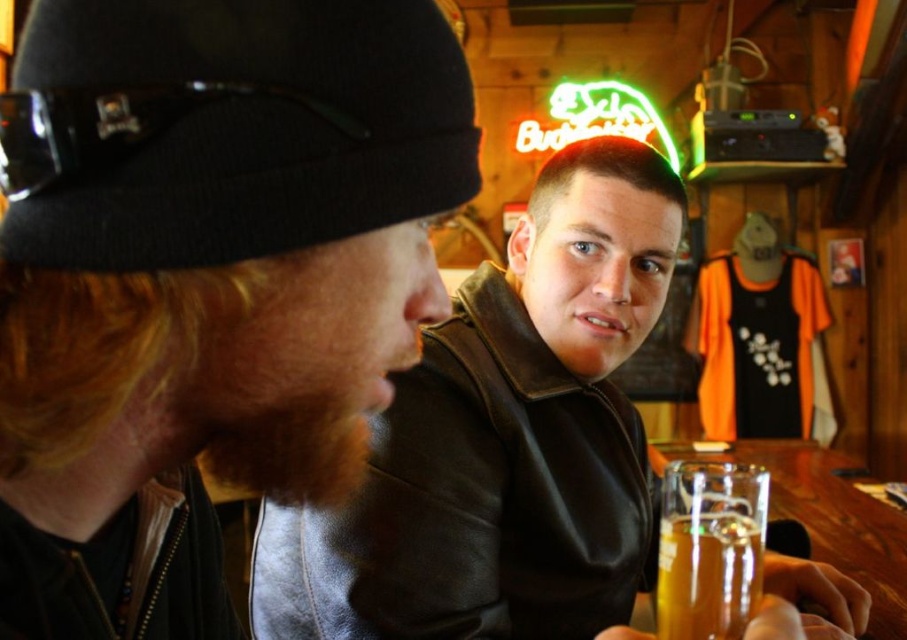
Question: Which point appears closest to the camera in this image?

Choices:
 (A) (96, 163)
 (B) (155, 164)
 (C) (678, 580)

Answer: (A)

Question: Is leather jacket at left positioned before black knit cap at upper left?

Choices:
 (A) yes
 (B) no

Answer: (B)

Question: Which object appears farthest from the camera in this image?

Choices:
 (A) translucent glass beer at lower right
 (B) leather jacket at center

Answer: (B)

Question: Is the position of leather jacket at left more distant than that of translucent glass beer at lower right?

Choices:
 (A) yes
 (B) no

Answer: (B)

Question: Does leather jacket at left lie behind translucent glass beer at lower right?

Choices:
 (A) no
 (B) yes

Answer: (A)

Question: Estimate the real-world distances between objects in this image. Which object is closer to the black knit cap at upper left?

Choices:
 (A) leather jacket at center
 (B) leather jacket at left

Answer: (B)